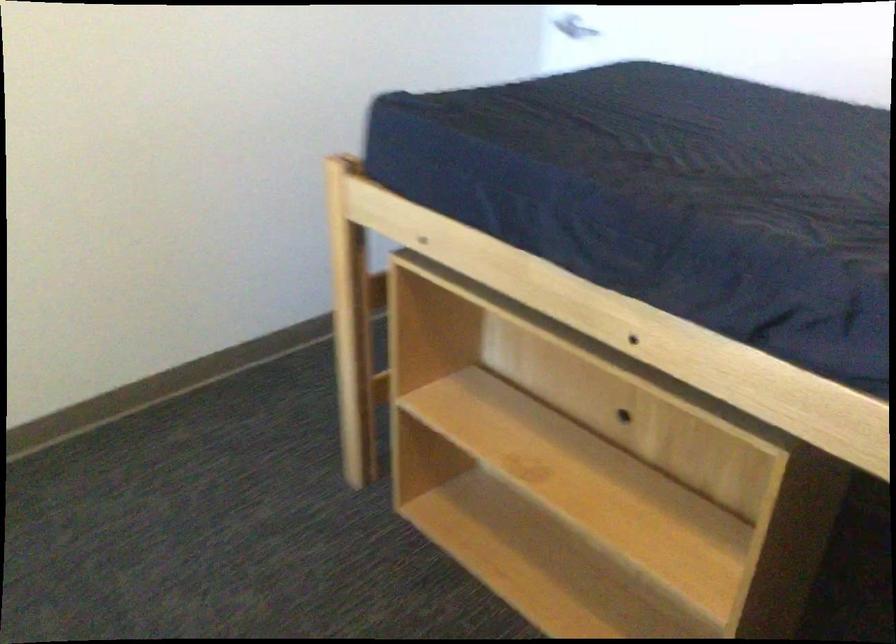
Where would you stepping on the wooden ladder rung? Please return your answer as a coordinate pair (x, y).

(377, 397)